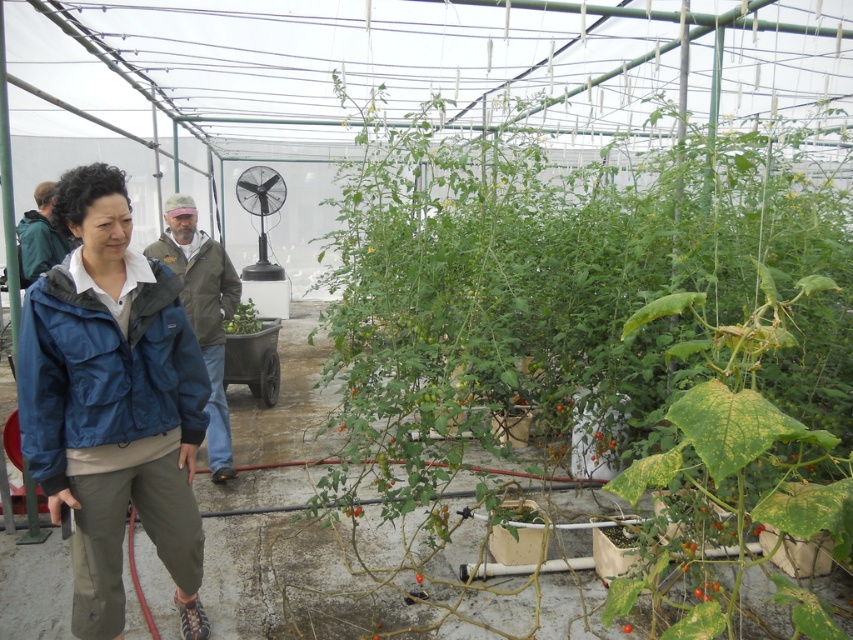
Can you confirm if green matte plant at center is smaller than red matte tomato at center?

No.

Which is more to the left, green matte plant at center or red matte tomato at center?

From the viewer's perspective, green matte plant at center appears more on the left side.

Who is more forward, (242, 333) or (625, 630)?

Point (625, 630) is in front.

At what (x,y) coordinates should I click in order to perform the action: click on green matte plant at center. Please return your answer as a coordinate pair (x, y). The image size is (853, 640). Looking at the image, I should click on (242, 320).

Can you confirm if blue fabric jacket at center is positioned above green matte plant at center?

Incorrect, blue fabric jacket at center is not positioned above green matte plant at center.

Where is `blue fabric jacket at center`? blue fabric jacket at center is located at coordinates (113, 403).

Which is in front, point (77, 428) or point (242, 332)?

Point (77, 428) is in front.

Find the location of a particular element. The height and width of the screenshot is (640, 853). blue fabric jacket at center is located at coordinates (113, 403).

Is point (222, 442) positioned behind point (416, 579)?

That is True.

Can you confirm if blue fabric jacket at left is positioned to the left of green matte tomato at center?

Indeed, blue fabric jacket at left is positioned on the left side of green matte tomato at center.

Measure the distance between point (183, 205) and camera.

Point (183, 205) is 4.23 meters from camera.

The height and width of the screenshot is (640, 853). In order to click on blue fabric jacket at left in this screenshot , I will do `click(202, 310)`.